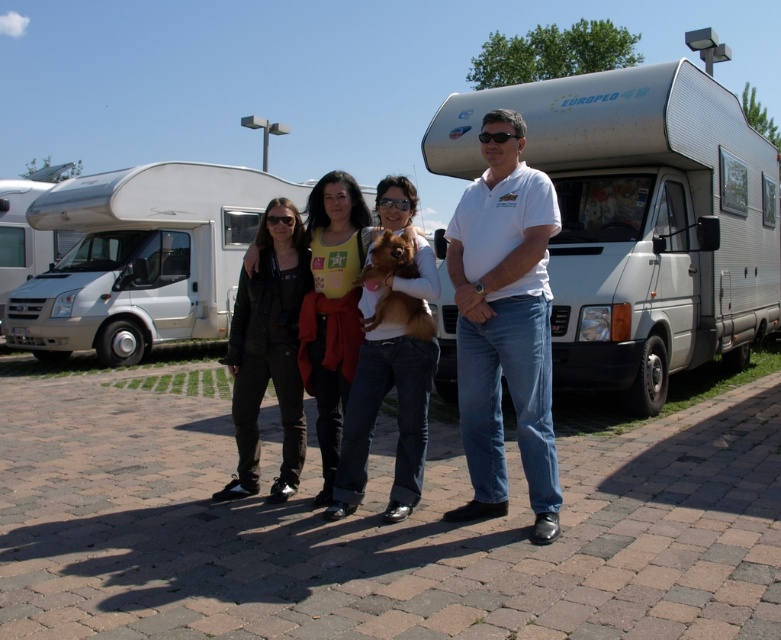
You are standing at the edge of the paved area and want to walk towards the white cotton shirt at center. Which direction should you walk to avoid passing in front of the matte white rv at upper right?

Since the matte white rv at upper right is positioned on the left side of the white cotton shirt at center, you should walk to the right side of the matte white rv at upper right to avoid passing in front of it.

You are standing on the paved area at the campsite and see the white cotton shirt at center and the white glossy recreational vehicle at left. Which object is closer to you?

The white cotton shirt at center is closer to you because it is in front of the white glossy recreational vehicle at left.